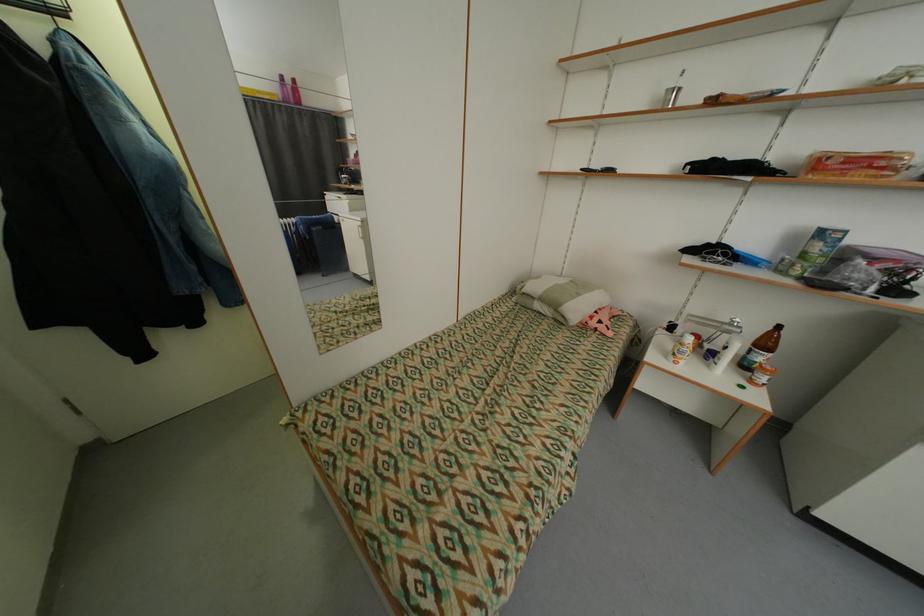
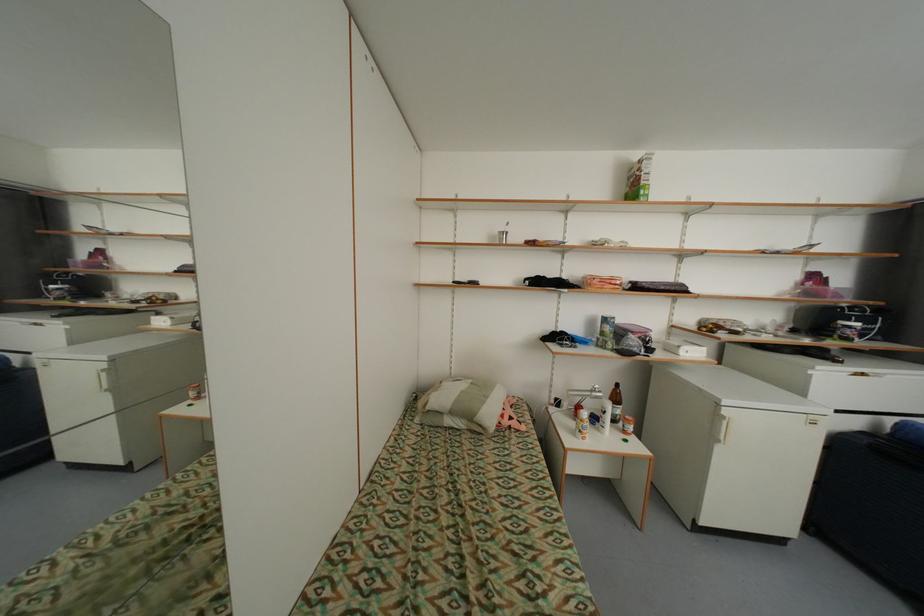
Question: The camera is either moving clockwise (left) or counter-clockwise (right) around the object. The first image is from the beginning of the video and the second image is from the end. Is the camera moving left or right when shooting the video?

Choices:
 (A) Left
 (B) Right

Answer: (A)